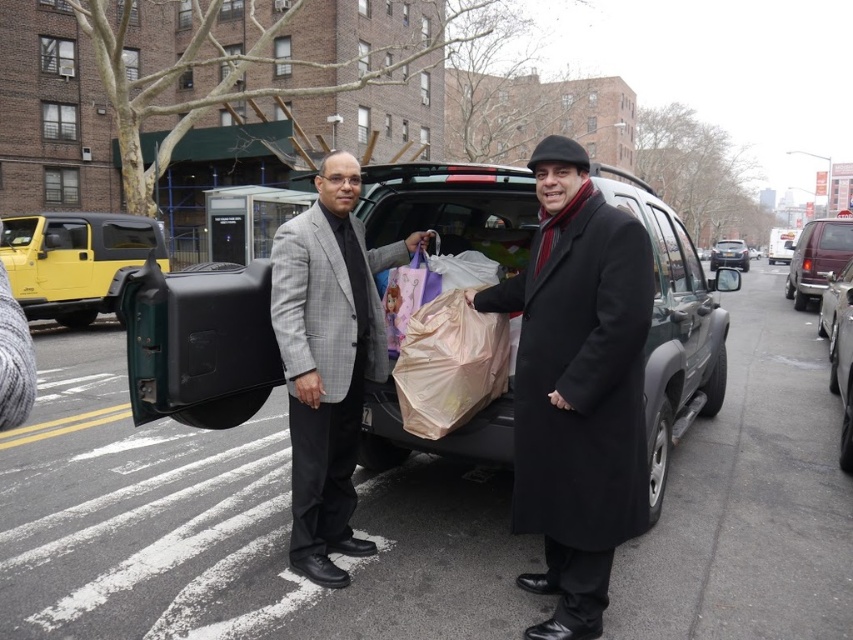
You are a delivery driver who needs to park your vehicle between the black matte car at center and the maroon metallic van at right. Can you fit your 2.5 meter long delivery van in the space between them?

The black matte car at center is shorter than the maroon metallic van at right, but the distance between them isn not specified. Without knowing the exact spacing between the vehicles, it is impossible to determine if the 2.5 meter long delivery van can fit.